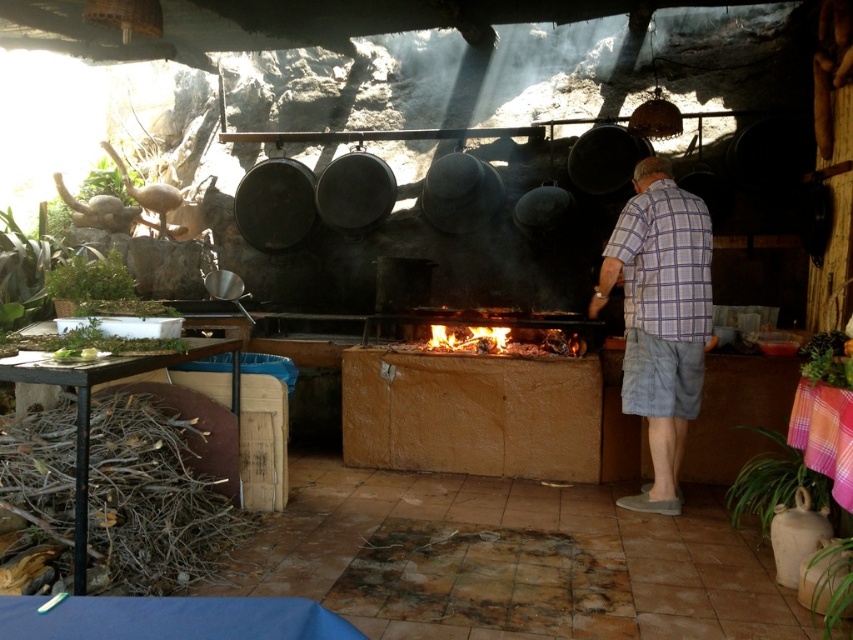
Question: Considering the relative positions of plaid shirt at center and burning wood at center in the image provided, where is plaid shirt at center located with respect to burning wood at center?

Choices:
 (A) below
 (B) above

Answer: (A)

Question: Among these objects, which one is farthest from the camera?

Choices:
 (A) plaid shirt at center
 (B) burning wood at center

Answer: (B)

Question: From the image, what is the correct spatial relationship of plaid shirt at center in relation to burning wood at center?

Choices:
 (A) above
 (B) below

Answer: (B)

Question: Considering the relative positions of plaid shirt at center and burning wood at center in the image provided, where is plaid shirt at center located with respect to burning wood at center?

Choices:
 (A) above
 (B) below

Answer: (B)